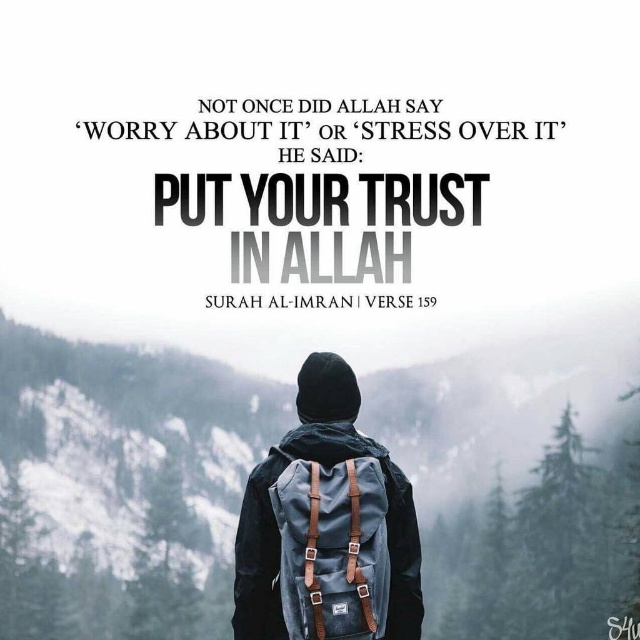
Does gray matte backpack at center appear under matte gray backpack at center?

Yes.

Is gray matte backpack at center thinner than matte gray backpack at center?

Incorrect, gray matte backpack at center's width is not less than matte gray backpack at center's.

Find the location of `gray matte backpack at center`. gray matte backpack at center is located at coordinates (122, 486).

Does gray matte backpack at center have a smaller size compared to black matte text at center?

Incorrect, gray matte backpack at center is not smaller in size than black matte text at center.

Measure the distance between gray matte backpack at center and black matte text at center.

gray matte backpack at center is 7.11 meters from black matte text at center.

At what (x,y) coordinates should I click in order to perform the action: click on gray matte backpack at center. Please return your answer as a coordinate pair (x, y). The width and height of the screenshot is (640, 640). Looking at the image, I should click on pos(122,486).

You are a GUI agent. You are given a task and a screenshot of the screen. Output one action in this format:
    pyautogui.click(x=<x>, y=<y>)
    Task: Click on the gray matte backpack at center
    
    Given the screenshot: What is the action you would take?
    pyautogui.click(x=122, y=486)

Who is taller, gray matte backpack at center or dark gray fabric backpack at center?

gray matte backpack at center

How much distance is there between gray matte backpack at center and dark gray fabric backpack at center?

A distance of 73.69 feet exists between gray matte backpack at center and dark gray fabric backpack at center.

The image size is (640, 640). What do you see at coordinates (122, 486) in the screenshot?
I see `gray matte backpack at center` at bounding box center [122, 486].

Where is `gray matte backpack at center`? The image size is (640, 640). gray matte backpack at center is located at coordinates 122,486.